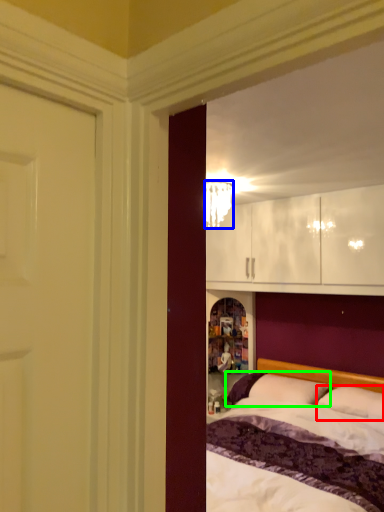
Question: Which object is positioned closest to pillow (highlighted by a red box)? Select from lamp (highlighted by a blue box) and pillow (highlighted by a green box).

Choices:
 (A) lamp
 (B) pillow

Answer: (B)